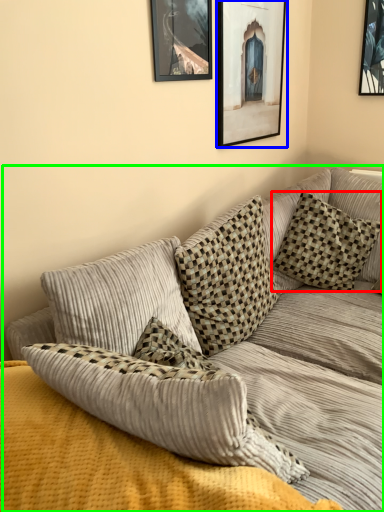
Question: Based on their relative distances, which object is nearer to pillow (highlighted by a red box)? Choose from picture frame (highlighted by a blue box) and studio couch (highlighted by a green box).

Choices:
 (A) picture frame
 (B) studio couch

Answer: (B)